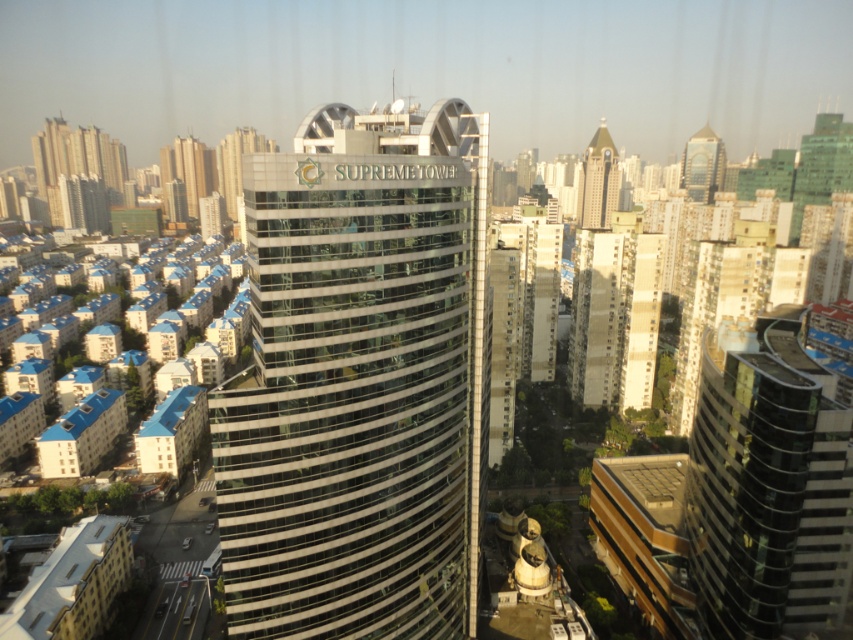
You are an architect analyzing the urban layout. You observe the glassy silver skyscraper at center and the beige concrete building at center. Which of these two structures is located to the left when viewed from your perspective?

The glassy silver skyscraper at center is positioned on the left side of the beige concrete building at center, so it is located to the left when viewed from your perspective.

You are a drone operator tasked with flying a drone between the glassy silver skyscraper at center and the beige concrete building at center. The drone has a maximum flight range of 150 meters. Can the drone safely travel between these two buildings without exceeding its range?

The distance between the glassy silver skyscraper at center and the beige concrete building at center is 125.20 meters, which is within the drone operator s 150 meter range. Therefore, the drone can safely travel between them without exceeding its maximum flight range.

You are standing at the base of the Supreme Tower and want to take a photo of the point at coordinates point (717,611). If your camera has a maximum zoom range of 100 meters, will you be able to capture that point clearly?

The distance of point (717,611) from camera is 105.84 meters, which exceeds the camera maximum zoom range of 100 meters. Therefore, you will not be able to capture the point clearly.